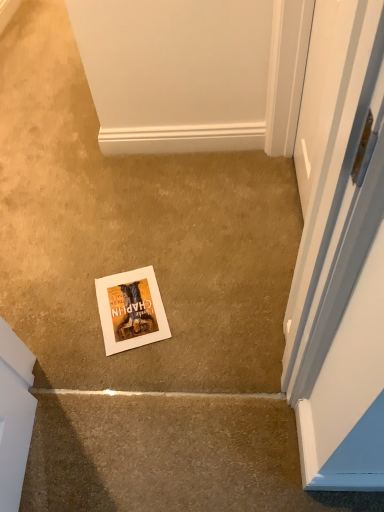
Find the location of a particular element. This screenshot has width=384, height=512. space that is in front of matte paper postcard at center is located at coordinates (133, 372).